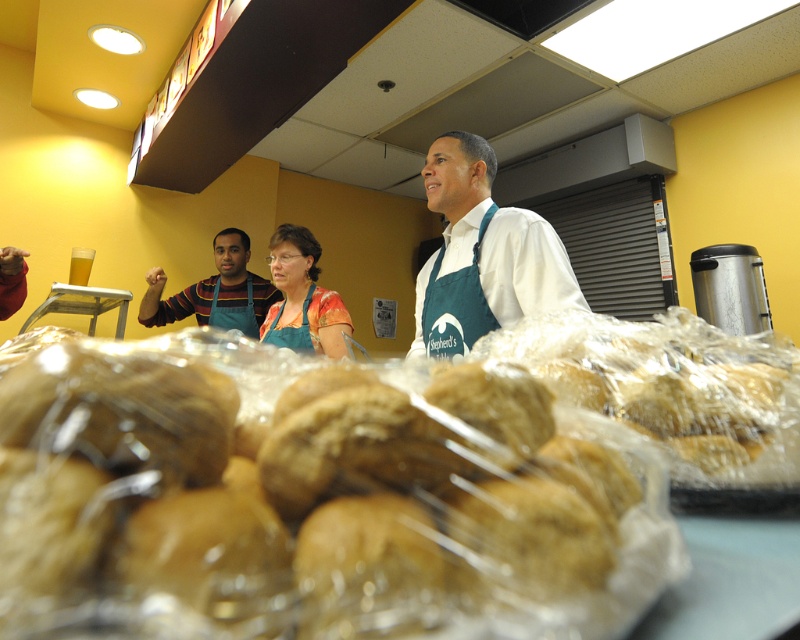
You are a customer at the bakery and want to know which of the two points, point [520,301] or point [218,321], is closer to you. Can you determine this based on the image?

Point [520,301] is closer to the camera than point [218,321].

Where is the golden brown bread at center located in the image?

The golden brown bread at center is located at point coordinates of (362, 483).